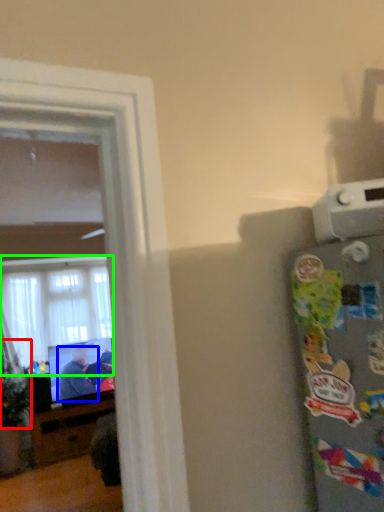
Question: Which is nearer to the plant (highlighted by a red box)? person (highlighted by a blue box) or window (highlighted by a green box).

Choices:
 (A) person
 (B) window

Answer: (A)